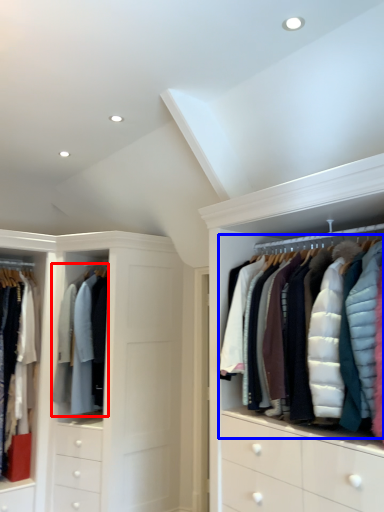
Question: Which object is closer to the camera taking this photo, clothing (highlighted by a red box) or garment (highlighted by a blue box)?

Choices:
 (A) clothing
 (B) garment

Answer: (B)